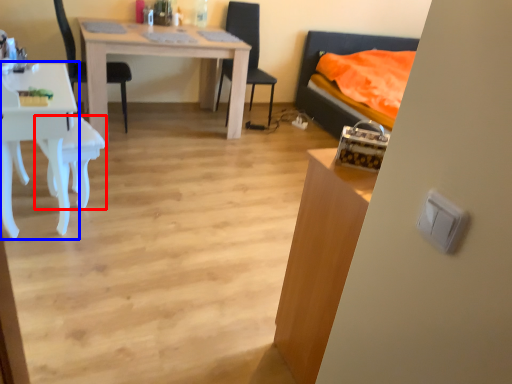
Question: Which object is further to the camera taking this photo, armchair (highlighted by a red box) or desk (highlighted by a blue box)?

Choices:
 (A) armchair
 (B) desk

Answer: (A)